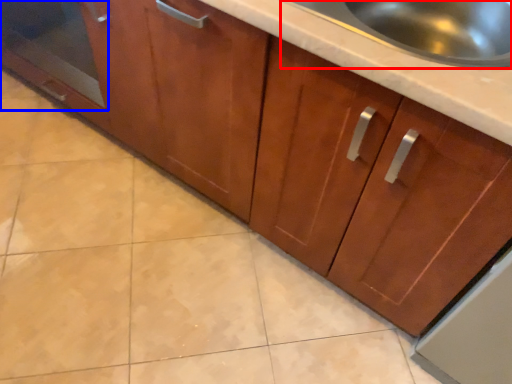
Question: Which object is closer to the camera taking this photo, sink (highlighted by a red box) or glass door (highlighted by a blue box)?

Choices:
 (A) sink
 (B) glass door

Answer: (A)